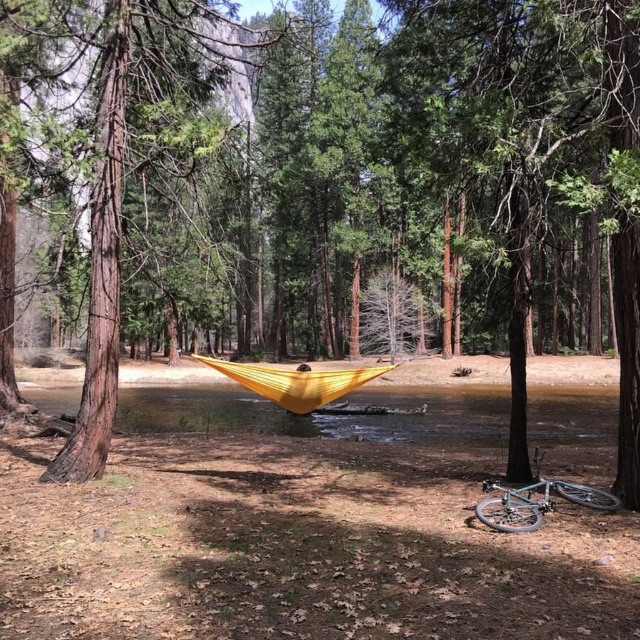
Can you confirm if yellow fabric hammock at center is smaller than teal metallic bicycle at lower right?

No, yellow fabric hammock at center is not smaller than teal metallic bicycle at lower right.

Where is `yellow fabric hammock at center`? yellow fabric hammock at center is located at coordinates (296, 381).

The width and height of the screenshot is (640, 640). What are the coordinates of `yellow fabric hammock at center` in the screenshot? It's located at (296, 381).

Does brown rough tree trunk at left appear on the right side of teal metallic bicycle at lower right?

Incorrect, brown rough tree trunk at left is not on the right side of teal metallic bicycle at lower right.

Can you confirm if brown rough tree trunk at left is positioned above teal metallic bicycle at lower right?

Indeed, brown rough tree trunk at left is positioned over teal metallic bicycle at lower right.

Which is in front, point (38, 35) or point (493, 486)?

Point (493, 486) is in front.

You are a GUI agent. You are given a task and a screenshot of the screen. Output one action in this format:
    pyautogui.click(x=<x>, y=<y>)
    Task: Click on the brown rough tree trunk at left
    Image resolution: width=640 pixels, height=640 pixels.
    Given the screenshot: What is the action you would take?
    pyautogui.click(x=125, y=163)

Does brown rough tree trunk at left appear on the right side of yellow fabric hammock at center?

In fact, brown rough tree trunk at left is to the left of yellow fabric hammock at center.

Based on the photo, does brown rough tree trunk at left have a smaller size compared to yellow fabric hammock at center?

Incorrect, brown rough tree trunk at left is not smaller in size than yellow fabric hammock at center.

Is point (113, 328) less distant than point (216, 369)?

Yes, it is in front of point (216, 369).

You are a GUI agent. You are given a task and a screenshot of the screen. Output one action in this format:
    pyautogui.click(x=<x>, y=<y>)
    Task: Click on the brown rough tree trunk at left
    The image size is (640, 640).
    Given the screenshot: What is the action you would take?
    pyautogui.click(x=125, y=163)